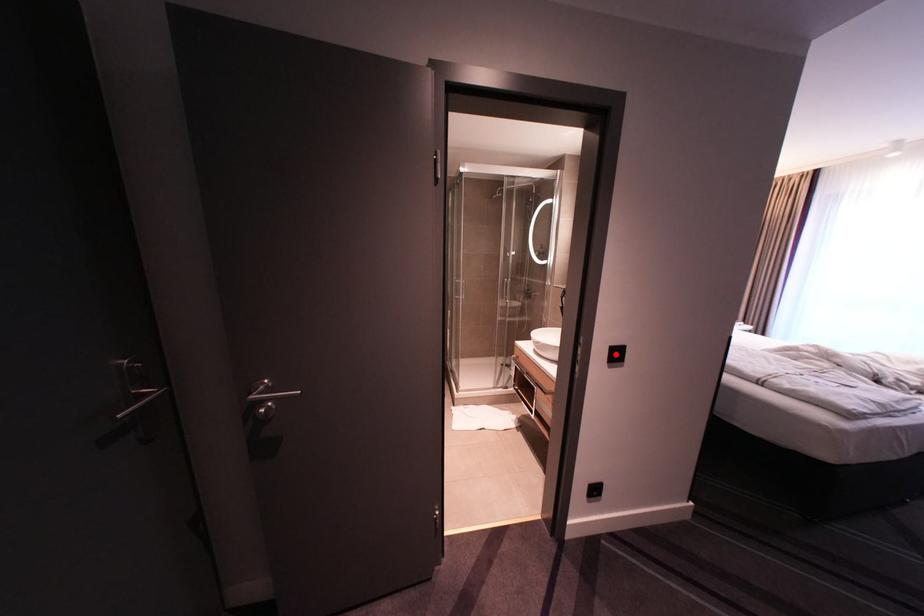
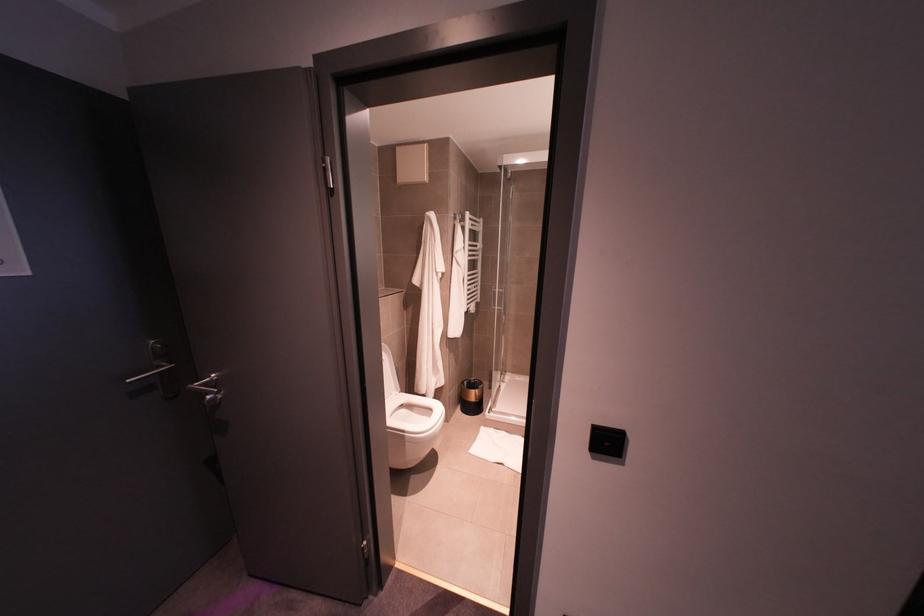
Question: I am providing you with two images of the same scene from different viewpoints. A red point is marked on the first image. Can you still see the location of the red point in image 2?

Choices:
 (A) Yes
 (B) No

Answer: (A)